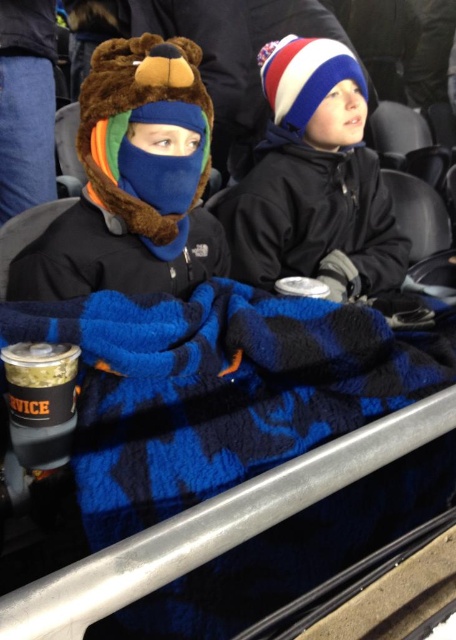
Question: From the image, what is the correct spatial relationship of blue fleece blanket at lower center in relation to white/red/blue knit hat at center?

Choices:
 (A) below
 (B) above

Answer: (A)

Question: Based on their relative distances, which object is nearer to the blue fleece blanket at lower center?

Choices:
 (A) fuzzy brown bear hat at center
 (B) white/red/blue knit hat at center

Answer: (A)

Question: Is blue fleece blanket at lower center closer to the viewer compared to white/red/blue knit hat at center?

Choices:
 (A) no
 (B) yes

Answer: (B)

Question: Which point is farther from the camera taking this photo?

Choices:
 (A) click(x=268, y=161)
 (B) click(x=362, y=481)

Answer: (A)

Question: Which of the following is the farthest from the observer?

Choices:
 (A) white/red/blue knit hat at center
 (B) fuzzy brown bear hat at center
 (C) blue fleece blanket at lower center

Answer: (A)

Question: Is fuzzy brown bear hat at center thinner than white/red/blue knit hat at center?

Choices:
 (A) no
 (B) yes

Answer: (B)